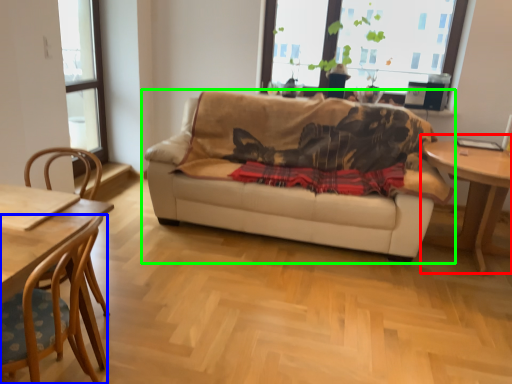
Question: Estimate the real-world distances between objects in this image. Which object is farther from table (highlighted by a red box), chair (highlighted by a blue box) or studio couch (highlighted by a green box)?

Choices:
 (A) chair
 (B) studio couch

Answer: (A)